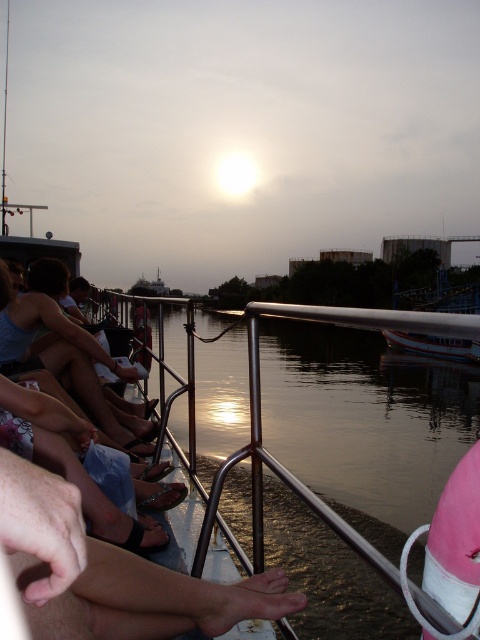
Which of these two, metallic water at lower center or matte black shorts at left, stands shorter?

metallic water at lower center

Does metallic water at lower center have a lesser width compared to matte black shorts at left?

No, metallic water at lower center is not thinner than matte black shorts at left.

Is point (269, 304) in front of point (49, 330)?

Yes, it is in front of point (49, 330).

Find the location of a particular element. Image resolution: width=480 pixels, height=640 pixels. metallic water at lower center is located at coordinates (288, 468).

Is smooth skin leg at lower center smaller than matte black shorts at left?

Yes.

Between point (117, 616) and point (69, 365), which one is positioned in front?

Positioned in front is point (117, 616).

Is point (135, 627) positioned behind point (40, 298)?

That is False.

Find the location of a particular element. smooth skin leg at lower center is located at coordinates [110, 573].

Who is taller, smooth skin leg at lower center or metallic water at lower center?

Standing taller between the two is metallic water at lower center.

Is smooth skin leg at lower center shorter than metallic water at lower center?

Indeed, smooth skin leg at lower center has a lesser height compared to metallic water at lower center.

What do you see at coordinates (110, 573) in the screenshot? I see `smooth skin leg at lower center` at bounding box center [110, 573].

Identify the location of smooth skin leg at lower center. Image resolution: width=480 pixels, height=640 pixels. (110, 573).